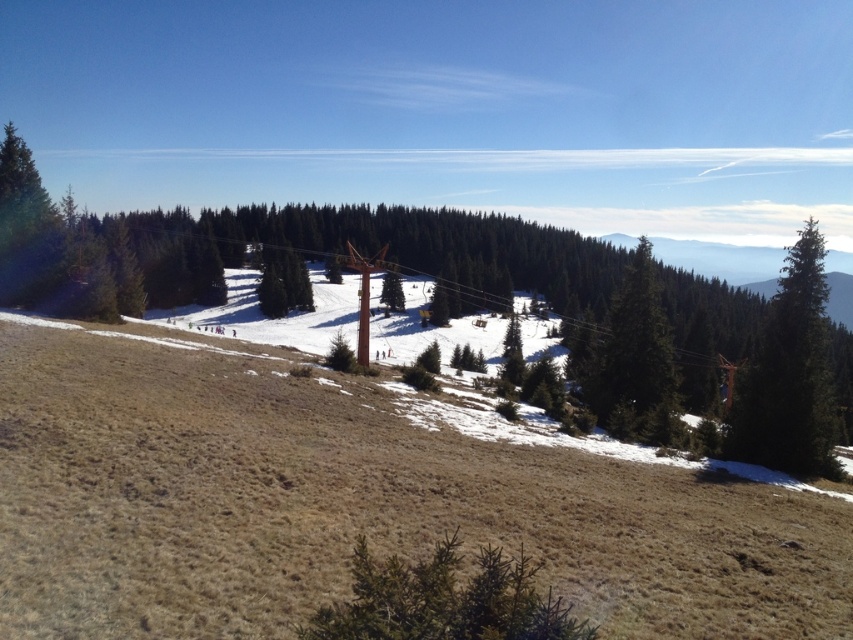
You are standing at the point labeled as point (445, 600) in the winter landscape image. What object would you be standing next to?

The point (445, 600) corresponds to the green matte tree at lower center, so you would be standing next to the green matte tree at lower center.